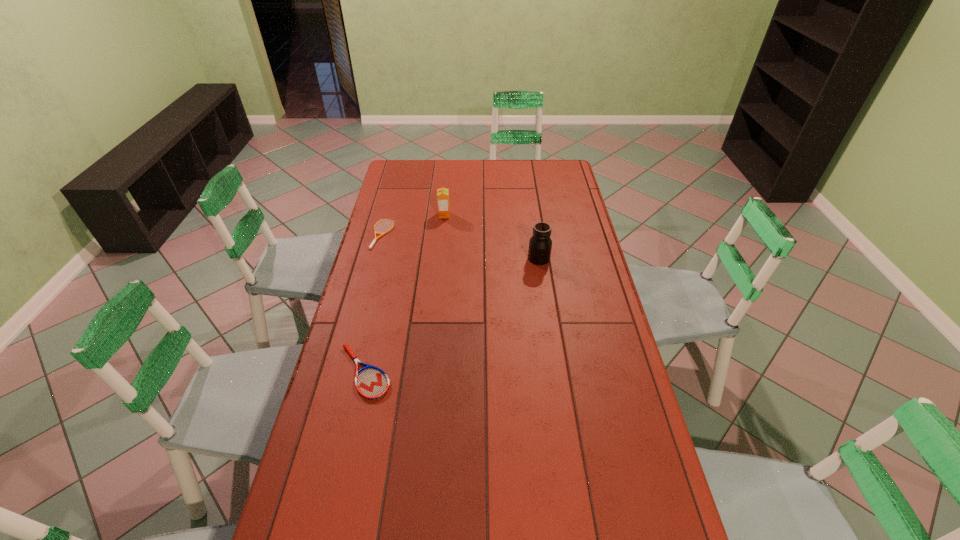
The height and width of the screenshot is (540, 960). I want to click on the second nearest object, so click(540, 244).

Image resolution: width=960 pixels, height=540 pixels. I want to click on the rightmost object, so click(540, 244).

In order to click on the third object from left to right in this screenshot , I will do `click(442, 194)`.

Where is `orange juice`? orange juice is located at coordinates (442, 194).

You are a GUI agent. You are given a task and a screenshot of the screen. Output one action in this format:
    pyautogui.click(x=<x>, y=<y>)
    Task: Click on the taller tennis racket
    This screenshot has height=540, width=960.
    Given the screenshot: What is the action you would take?
    pyautogui.click(x=372, y=383)

I want to click on the nearest object, so click(372, 383).

Locate an element on the screen. the farther tennis racket is located at coordinates click(382, 233).

At what (x,y) coordinates should I click in order to perform the action: click on the third nearest object. Please return your answer as a coordinate pair (x, y). Looking at the image, I should click on (382, 233).

You are a GUI agent. You are given a task and a screenshot of the screen. Output one action in this format:
    pyautogui.click(x=<x>, y=<y>)
    Task: Click on the vacant space situated on the front of the rightmost object
    Image resolution: width=960 pixels, height=540 pixels.
    Given the screenshot: What is the action you would take?
    pyautogui.click(x=549, y=324)

Find the location of `vacant position located 0.090m on the back of the orange juice`. vacant position located 0.090m on the back of the orange juice is located at coordinates (445, 201).